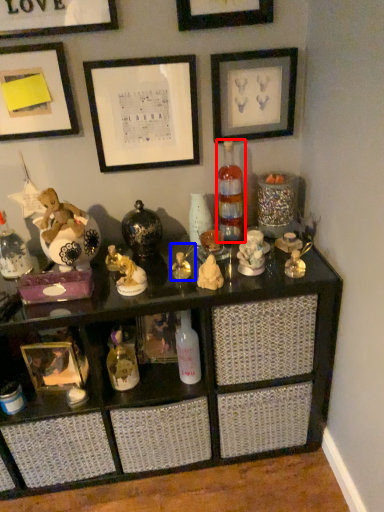
Question: Which object is further to the camera taking this photo, bottle (highlighted by a red box) or toy (highlighted by a blue box)?

Choices:
 (A) bottle
 (B) toy

Answer: (A)